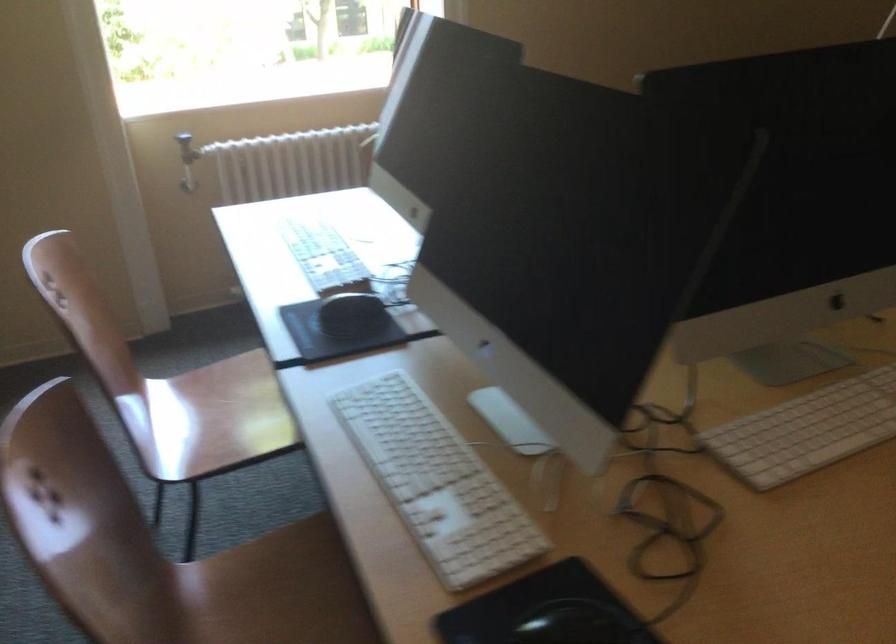
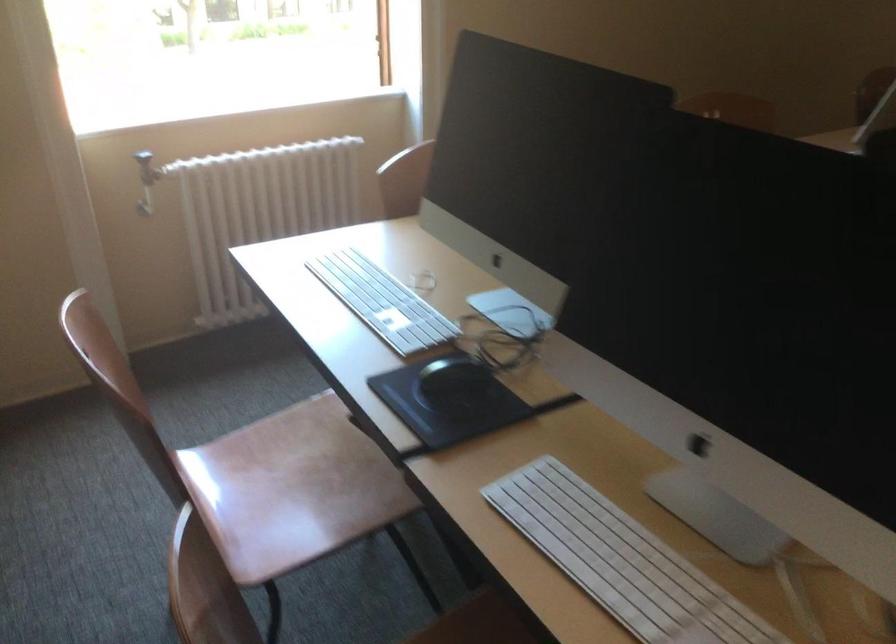
Question: I am providing you with two images of the same scene from different viewpoints. Please identify which objects are invisible in image2.

Choices:
 (A) black circular dial
 (B) radiator valve
 (C) black computer mouse
 (D) none of these

Answer: (D)